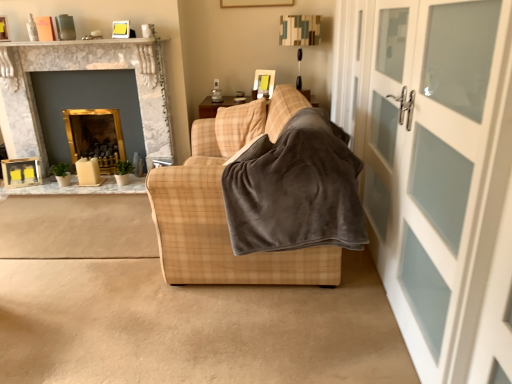
Question: Do you think white frosted glass door at right is within gray fleece blanket at center, or outside of it?

Choices:
 (A) outside
 (B) inside

Answer: (A)

Question: In terms of height, does white frosted glass door at right look taller or shorter compared to gray fleece blanket at center?

Choices:
 (A) short
 (B) tall

Answer: (B)

Question: Which object is positioned closest to the white marble fireplace at upper center?

Choices:
 (A) wooden table at left
 (B) white frosted glass door at right
 (C) gold marble fireplace at upper left
 (D) gray fleece blanket at center
 (E) plaid fabric couch at center

Answer: (C)

Question: Which of these objects is positioned closest to the plaid fabric couch at center?

Choices:
 (A) gold marble fireplace at upper left
 (B) white frosted glass door at right
 (C) gray fleece blanket at center
 (D) white marble fireplace at upper center
 (E) wooden table at left

Answer: (C)